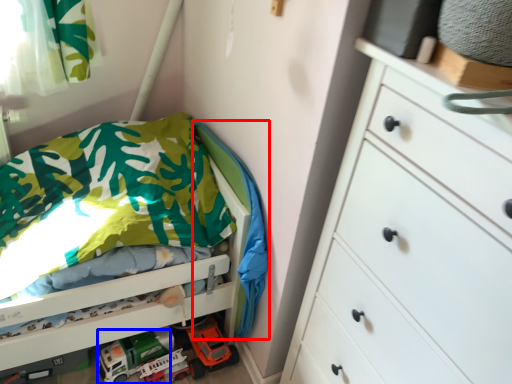
Question: Which point is closer to the camera, blanket (highlighted by a red box) or toy car (highlighted by a blue box)?

Choices:
 (A) blanket
 (B) toy car

Answer: (A)